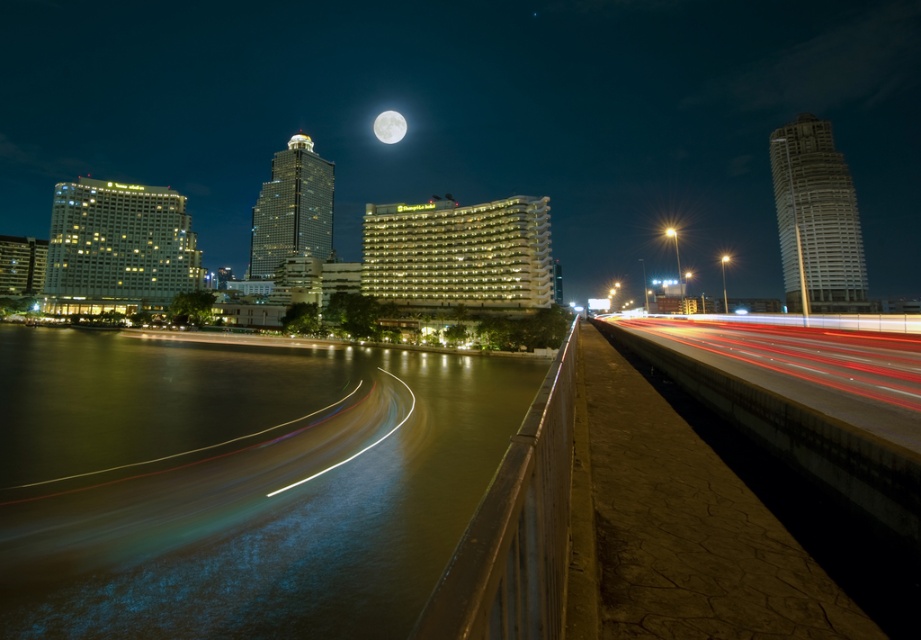
Question: Estimate the real-world distances between objects in this image. Which object is farther from the smooth concrete bridge at center?

Choices:
 (A) white glossy moon at upper center
 (B) greenish water at lower left

Answer: (B)

Question: Can you confirm if greenish water at lower left is positioned to the right of white glossy moon at upper center?

Choices:
 (A) no
 (B) yes

Answer: (B)

Question: Which is farther from the white glossy moon at upper center?

Choices:
 (A) smooth concrete highway at right
 (B) greenish water at lower left
 (C) smooth concrete bridge at center

Answer: (A)

Question: Is greenish water at lower left above white glossy moon at upper center?

Choices:
 (A) no
 (B) yes

Answer: (A)

Question: Is smooth concrete bridge at center closer to camera compared to smooth concrete highway at right?

Choices:
 (A) yes
 (B) no

Answer: (B)

Question: Estimate the real-world distances between objects in this image. Which object is closer to the smooth concrete highway at right?

Choices:
 (A) greenish water at lower left
 (B) white glossy moon at upper center

Answer: (A)